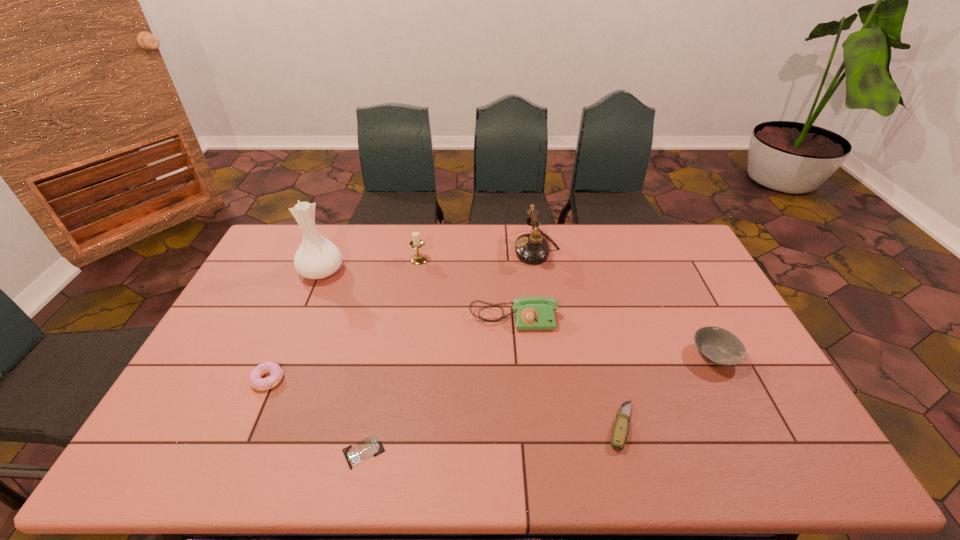
At what (x,y) coordinates should I click in order to perform the action: click on pocketknife. Please return your answer as a coordinate pair (x, y). The height and width of the screenshot is (540, 960). Looking at the image, I should click on (619, 435).

Locate an element on the screen. the shortest object is located at coordinates (371, 446).

What are the coordinates of `free space located 0.340m on the front of the tallest object` in the screenshot? It's located at (281, 368).

Locate an element on the screen. This screenshot has width=960, height=540. vacant region located 0.140m on the dial of the taller telephone is located at coordinates (477, 249).

I want to click on vacant position located 0.320m on the dial of the taller telephone, so click(429, 249).

The height and width of the screenshot is (540, 960). In order to click on free spot located on the dial of the taller telephone in this screenshot , I will do `click(501, 249)`.

Where is `vacant space located 0.190m on the right of the third tallest object`? vacant space located 0.190m on the right of the third tallest object is located at coordinates (480, 260).

Locate an element on the screen. free location located on the dial of the shorter telephone is located at coordinates (516, 352).

The height and width of the screenshot is (540, 960). I want to click on blank area located 0.270m on the back of the bowl, so click(675, 279).

This screenshot has height=540, width=960. Identify the location of vacant space located 0.330m on the back of the third shortest object. (307, 288).